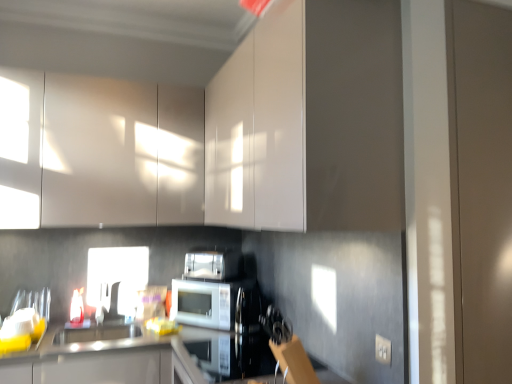
Question: Looking at their shapes, would you say satin silver toaster at center is wider or thinner than glossy white cabinets at upper left, which is the 2th cabinetry in right-to-left order?

Choices:
 (A) wide
 (B) thin

Answer: (B)

Question: Which is correct: satin silver toaster at center is inside glossy white cabinets at upper left, the 1th cabinetry from the left, or outside of it?

Choices:
 (A) outside
 (B) inside

Answer: (A)

Question: Which object is positioned closest to the satin silver toaster at center?

Choices:
 (A) white plastic electric outlet at lower right
 (B) satin black oven at center
 (C) satin silver microwave at center
 (D) translucent glass bottle at lower left
 (E) glossy white cabinet at upper center, which is counted as the 1th cabinetry, starting from the right

Answer: (C)

Question: Considering the real-world distances, which object is farthest from the glossy white cabinet at upper center, which is counted as the 1th cabinetry, starting from the right?

Choices:
 (A) translucent glass bottle at lower left
 (B) white plastic electric outlet at lower right
 (C) white glossy sink at lower center
 (D) satin black oven at center
 (E) glossy white cabinets at upper left, which is the 2th cabinetry in right-to-left order

Answer: (B)